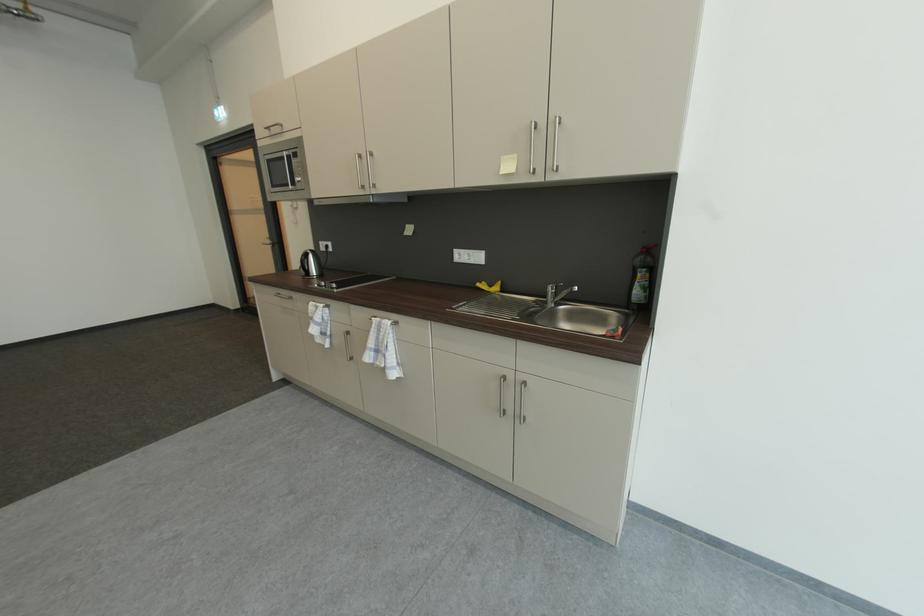
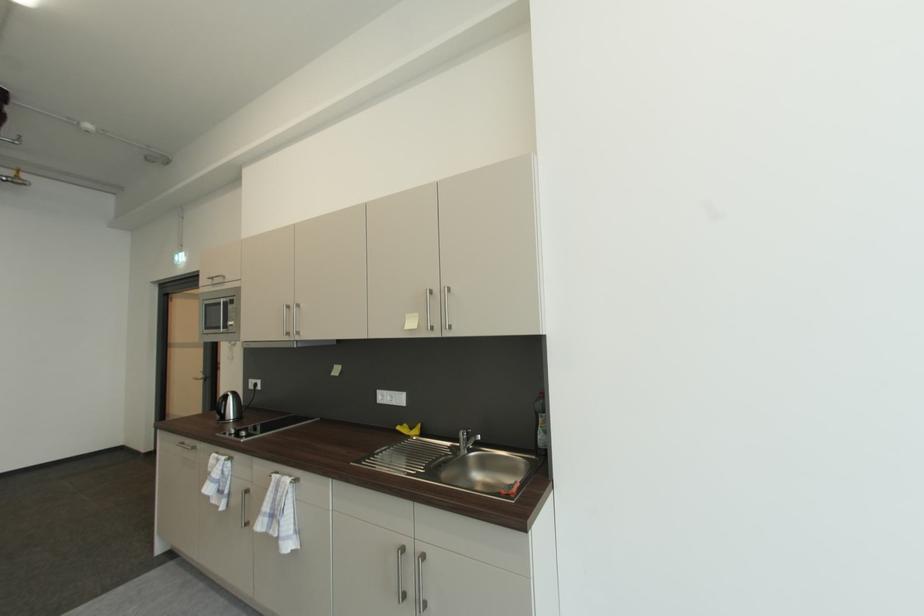
Question: The first image is from the beginning of the video and the second image is from the end. How did the camera likely rotate when shooting the video?

Choices:
 (A) Left
 (B) Right
 (C) Up
 (D) Down

Answer: (C)